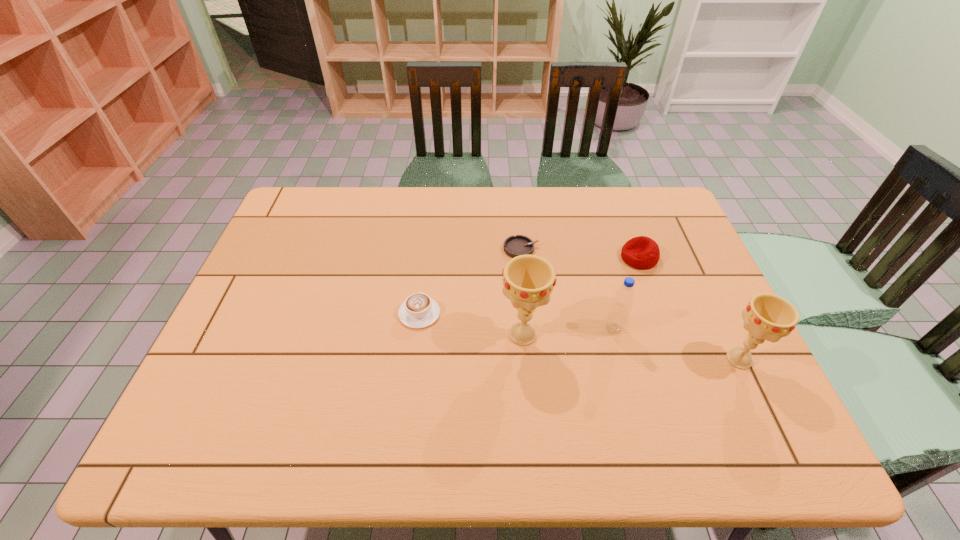
Please point out where to position a new chalice on the left to maintain spacing. Please provide its 2D coordinates. Your answer should be formatted as a tuple, i.e. [(x, y)], where the tuple contains the x and y coordinates of a point satisfying the conditions above.

[(325, 312)]